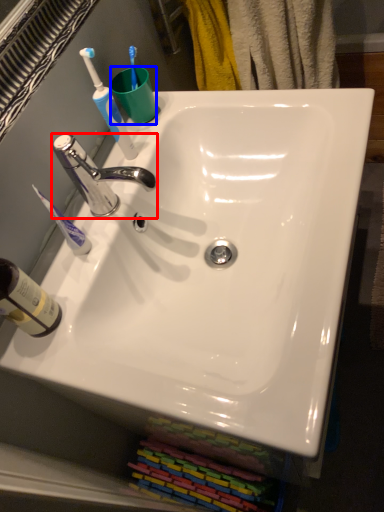
Question: Which object appears closest to the camera in this image, tap (highlighted by a red box) or coffee cup (highlighted by a blue box)?

Choices:
 (A) tap
 (B) coffee cup

Answer: (A)